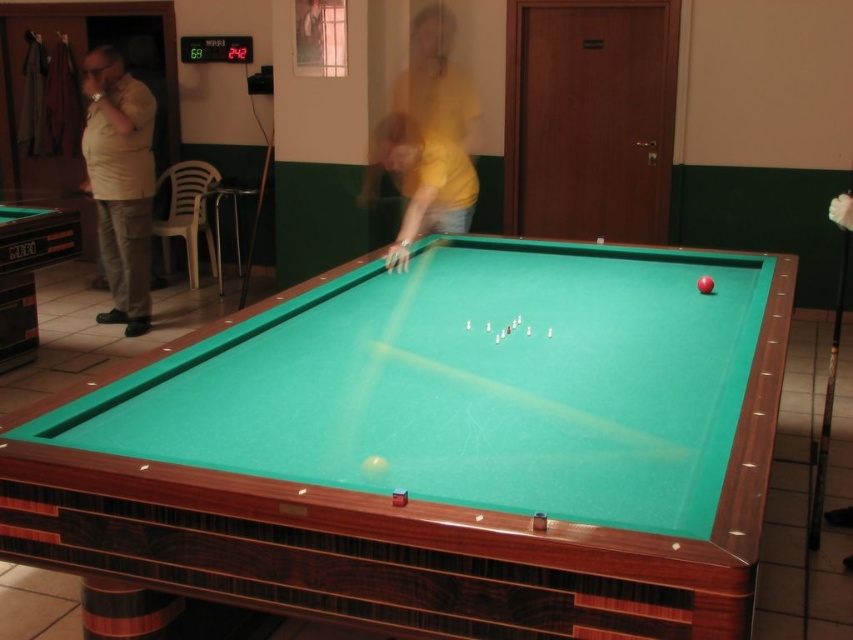
Is yellow matte shirt at center below green felt billiard table at left?

No.

Looking at this image, does yellow matte shirt at center have a greater height compared to green felt billiard table at left?

Indeed, yellow matte shirt at center has a greater height compared to green felt billiard table at left.

The height and width of the screenshot is (640, 853). I want to click on yellow matte shirt at center, so click(x=421, y=180).

The width and height of the screenshot is (853, 640). Identify the location of yellow matte shirt at center. (421, 180).

Which of these two, green felt billiard table at left or wooden cue at center, stands shorter?

green felt billiard table at left

Is point (15, 296) positioned behind point (253, 212)?

No, (15, 296) is closer to viewer.

Locate an element on the screen. green felt billiard table at left is located at coordinates (28, 273).

Does green felt billiard table at center appear on the right side of green felt billiard table at left?

Indeed, green felt billiard table at center is positioned on the right side of green felt billiard table at left.

Does point (190, 570) come behind point (49, 236)?

That is False.

Identify the location of green felt billiard table at center. This screenshot has height=640, width=853. (403, 477).